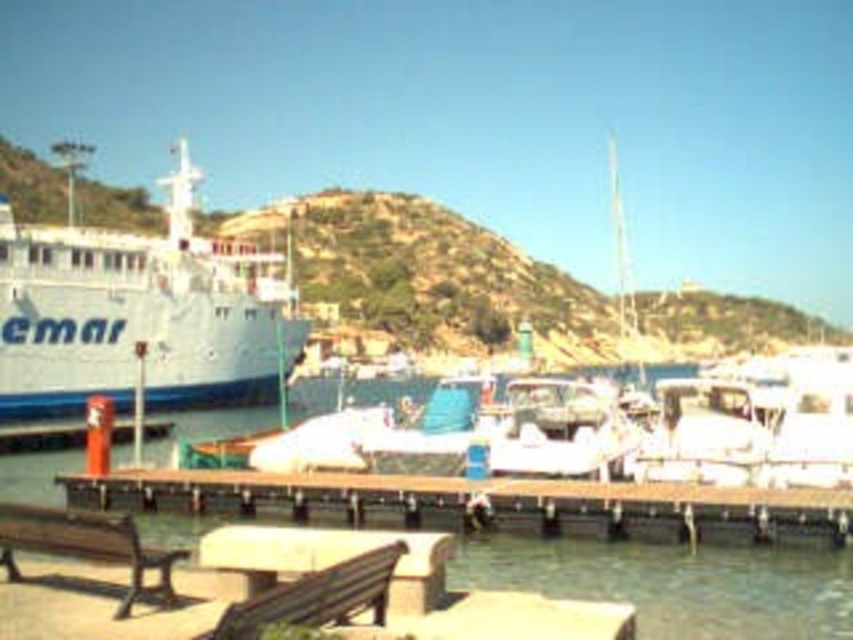
You are planning to take a photo of the white matte cruise ship at left and the brown wooden dock at lower center. Which object should you focus on first if you want to capture both in the frame without moving the camera?

The white matte cruise ship at left is larger in size compared to the brown wooden dock at lower center, so you should focus on the cruise ship first to ensure it fits properly in the frame.

You are standing on the wooden dock and see a point marked at coordinates (138, 314). What object is located at that point?

The point at coordinates (138, 314) indicates the white matte cruise ship at left.

You are a photographer standing on the brown wooden dock at lower center and want to take a photo of the white matte cruise ship at left. Since the dock is wooden and might not support heavy equipment, can you safely place a tripod on the dock to capture the ship?

The white matte cruise ship at left is positioned over the brown wooden dock at lower center, meaning the dock is directly under the ship. Since the dock is already supporting the ship, it should be sturdy enough to hold a tripod for taking photos.